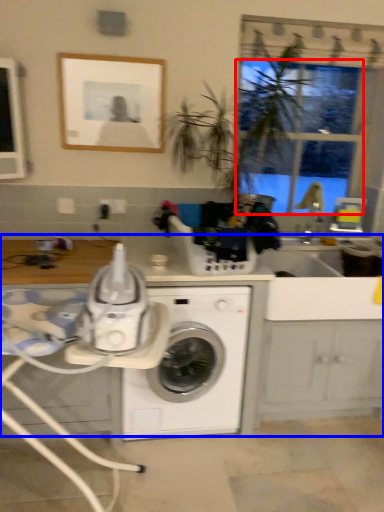
Question: Among these objects, which one is farthest to the camera, window screen (highlighted by a red box) or counter top (highlighted by a blue box)?

Choices:
 (A) window screen
 (B) counter top

Answer: (A)